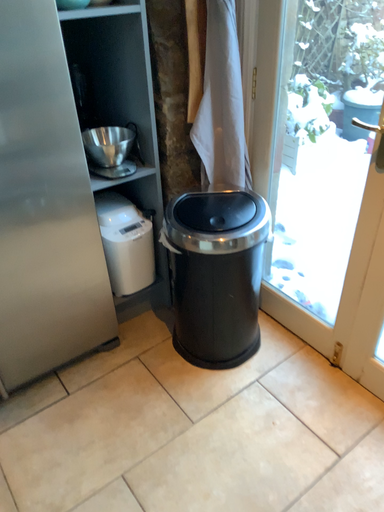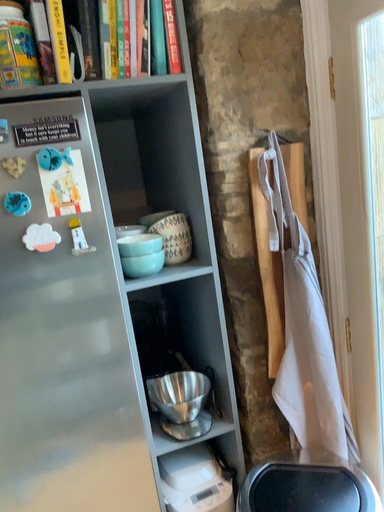
Question: How did the camera likely rotate when shooting the video?

Choices:
 (A) rotated downward
 (B) rotated upward

Answer: (B)